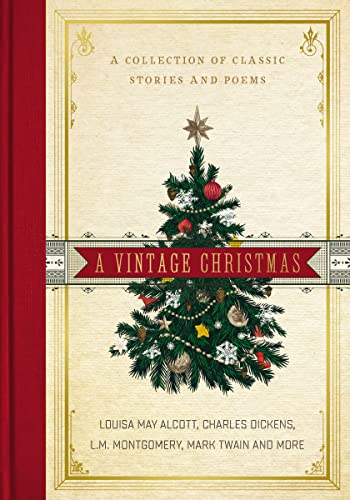
This screenshot has height=500, width=350. What are the coordinates of `book binding` in the screenshot? It's located at (6, 52), (5, 430).